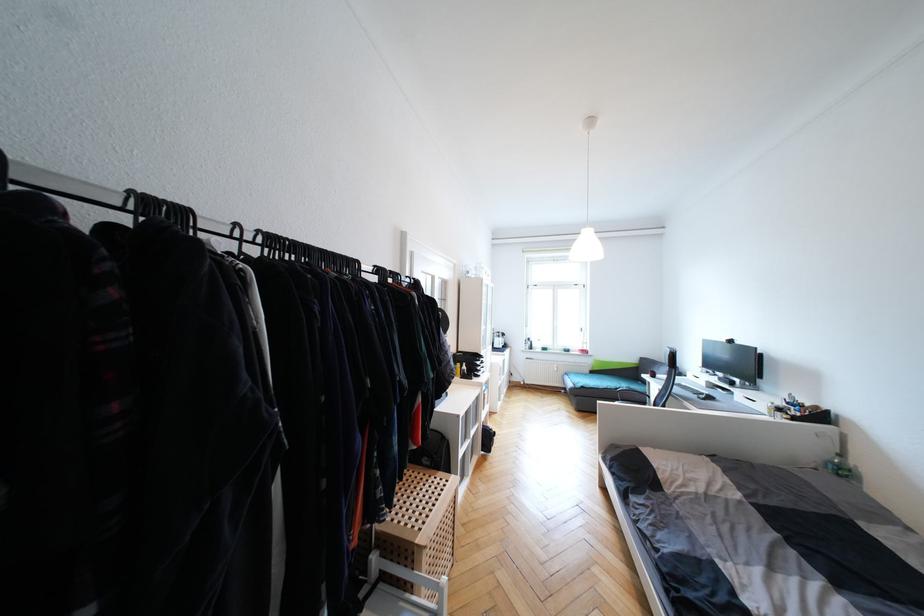
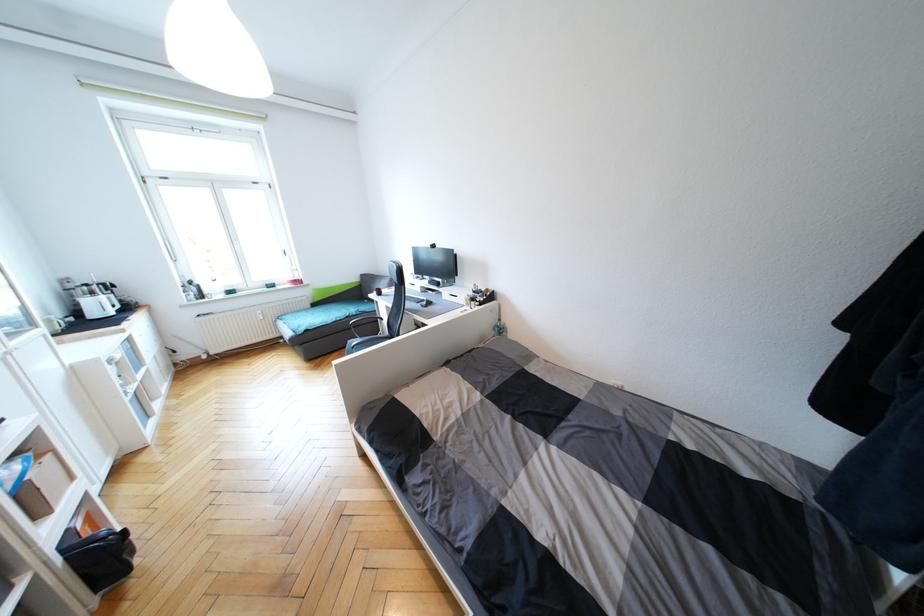
The point at (x=845, y=472) is marked in the first image. Where is the corresponding point in the second image?

(504, 331)